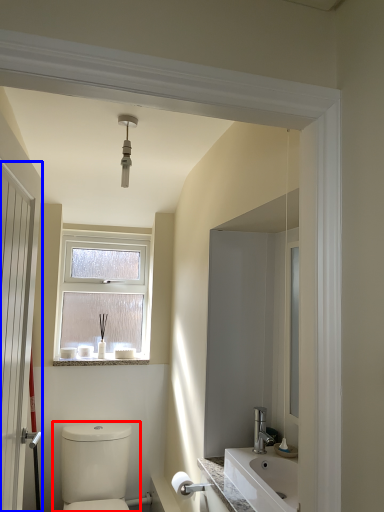
Question: Which point is closer to the camera, toilet (highlighted by a red box) or door (highlighted by a blue box)?

Choices:
 (A) toilet
 (B) door

Answer: (B)